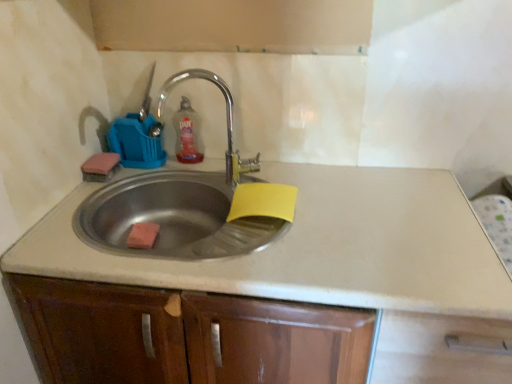
Question: Should I look upward or downward to see orange sponge at sink?

Choices:
 (A) down
 (B) up

Answer: (A)

Question: Are translucent plastic bottle at upper center and stainless steel sink at center beside each other?

Choices:
 (A) yes
 (B) no

Answer: (B)

Question: Can you confirm if translucent plastic bottle at upper center is taller than stainless steel sink at center?

Choices:
 (A) no
 (B) yes

Answer: (A)

Question: Is stainless steel sink at center located within translucent plastic bottle at upper center?

Choices:
 (A) yes
 (B) no

Answer: (B)

Question: From a real-world perspective, is translucent plastic bottle at upper center physically below stainless steel sink at center?

Choices:
 (A) yes
 (B) no

Answer: (B)

Question: Is translucent plastic bottle at upper center aimed at stainless steel sink at center?

Choices:
 (A) no
 (B) yes

Answer: (B)

Question: Considering the relative sizes of translucent plastic bottle at upper center and stainless steel sink at center in the image provided, is translucent plastic bottle at upper center shorter than stainless steel sink at center?

Choices:
 (A) no
 (B) yes

Answer: (B)

Question: Can you confirm if orange sponge at sink is smaller than stainless steel sink at center?

Choices:
 (A) yes
 (B) no

Answer: (A)

Question: Considering the relative sizes of orange sponge at sink and stainless steel sink at center in the image provided, is orange sponge at sink taller than stainless steel sink at center?

Choices:
 (A) yes
 (B) no

Answer: (B)

Question: Considering the relative positions of orange sponge at sink and stainless steel sink at center in the image provided, is orange sponge at sink in front of stainless steel sink at center?

Choices:
 (A) yes
 (B) no

Answer: (B)

Question: Is orange sponge at sink outside of stainless steel sink at center?

Choices:
 (A) no
 (B) yes

Answer: (A)

Question: Could you tell me if orange sponge at sink is turned towards stainless steel sink at center?

Choices:
 (A) yes
 (B) no

Answer: (A)

Question: Is orange sponge at sink bigger than stainless steel sink at center?

Choices:
 (A) yes
 (B) no

Answer: (B)

Question: Does stainless steel sink at center have a smaller size compared to translucent plastic bottle at upper center?

Choices:
 (A) no
 (B) yes

Answer: (A)